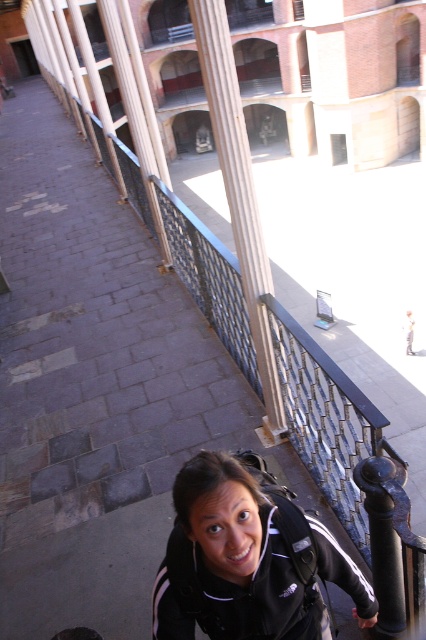
You are standing at the railing in the courtyard and looking down. There are two points marked in the scene. Which point, point (238,570) or point (230,184), is closer to you?

Point (238,570) is closer to you than point (230,184).

You are standing at the point marked as point [247,560] in the image. You want to pick up the black fabric backpack at lower center. Which direction should you move to reach it?

The black fabric backpack at lower center is located at point [247,560], so you are already at the correct location to pick it up.

You are a visitor in this historic building and need to place your black fabric backpack at lower center next to the white polished stone column at center. Considering their sizes, will the backpack fit comfortably next to the column without blocking the pathway?

The black fabric backpack at lower center is shorter than the white polished stone column at center, so it should fit comfortably next to the column without blocking the pathway.